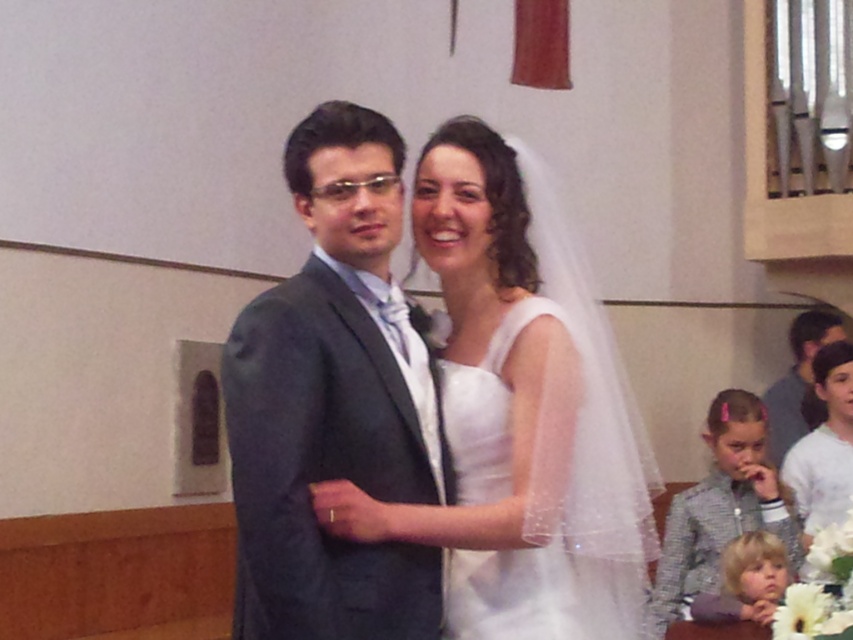
Question: Considering the relative positions of white satin dress at center and smooth dark hair at right in the image provided, where is white satin dress at center located with respect to smooth dark hair at right?

Choices:
 (A) above
 (B) below

Answer: (A)

Question: Which of these objects is positioned farthest from the matte gray suit at center?

Choices:
 (A) white satin dress at center
 (B) white sheer fabric dress at center
 (C) smooth dark hair at right

Answer: (C)

Question: Which of these objects is positioned farthest from the matte gray suit at center?

Choices:
 (A) white cotton shirt at center
 (B) white sheer fabric dress at center
 (C) smooth dark hair at right
 (D) white satin dress at center

Answer: (C)

Question: Is white sheer fabric dress at center positioned in front of smooth dark hair at right?

Choices:
 (A) yes
 (B) no

Answer: (A)

Question: Is white sheer fabric dress at center smaller than white cotton shirt at center?

Choices:
 (A) no
 (B) yes

Answer: (B)

Question: Which object appears farthest from the camera in this image?

Choices:
 (A) smooth dark hair at right
 (B) white satin dress at center

Answer: (A)